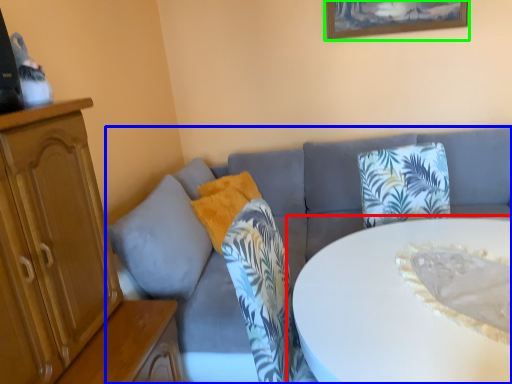
Question: Estimate the real-world distances between objects in this image. Which object is farther from table (highlighted by a red box), studio couch (highlighted by a blue box) or picture frame (highlighted by a green box)?

Choices:
 (A) studio couch
 (B) picture frame

Answer: (B)